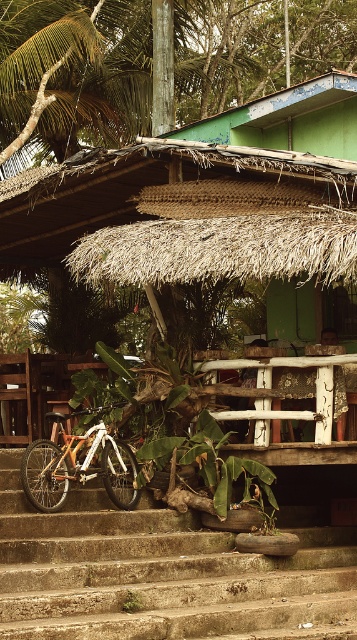
Question: Among these points, which one is nearest to the camera?

Choices:
 (A) (328, 412)
 (B) (258, 108)

Answer: (A)

Question: Where is concrete stairs at lower center located in relation to orange matte bicycle at lower left in the image?

Choices:
 (A) below
 (B) above

Answer: (A)

Question: Does orange matte bicycle at lower left have a smaller size compared to white wood balustrade at center?

Choices:
 (A) yes
 (B) no

Answer: (B)

Question: Which point is closer to the camera?

Choices:
 (A) (149, 588)
 (B) (243, 417)

Answer: (A)

Question: Does concrete stairs at lower center appear under orange matte bicycle at lower left?

Choices:
 (A) yes
 (B) no

Answer: (A)

Question: Which of the following is the farthest from the observer?

Choices:
 (A) white wood balustrade at center
 (B) orange matte bicycle at lower left
 (C) concrete stairs at lower center

Answer: (A)